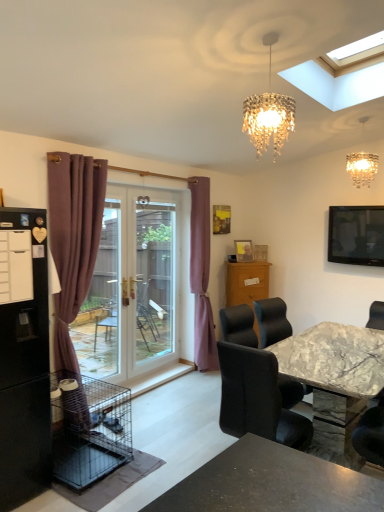
Question: Is marble table at center shorter than marble-textured chair at lower right?

Choices:
 (A) yes
 (B) no

Answer: (B)

Question: Is marble table at center positioned beyond the bounds of marble-textured chair at lower right?

Choices:
 (A) yes
 (B) no

Answer: (A)

Question: Is marble table at center far away from marble-textured chair at lower right?

Choices:
 (A) no
 (B) yes

Answer: (A)

Question: Considering the relative sizes of marble table at center and marble-textured chair at lower right in the image provided, is marble table at center wider than marble-textured chair at lower right?

Choices:
 (A) yes
 (B) no

Answer: (A)

Question: Can you confirm if marble table at center is bigger than marble-textured chair at lower right?

Choices:
 (A) yes
 (B) no

Answer: (A)

Question: Is marble table at center taller than marble-textured chair at lower right?

Choices:
 (A) yes
 (B) no

Answer: (A)

Question: From the image's perspective, does wooden picture frame at center appear lower than crystal glass chandelier at upper center?

Choices:
 (A) no
 (B) yes

Answer: (B)

Question: From a real-world perspective, is wooden picture frame at center below crystal glass chandelier at upper center?

Choices:
 (A) yes
 (B) no

Answer: (A)

Question: From the image's perspective, is wooden picture frame at center above crystal glass chandelier at upper center?

Choices:
 (A) yes
 (B) no

Answer: (B)

Question: Does wooden picture frame at center have a larger size compared to crystal glass chandelier at upper center?

Choices:
 (A) no
 (B) yes

Answer: (A)

Question: Is crystal glass chandelier at upper center completely or partially inside wooden picture frame at center?

Choices:
 (A) no
 (B) yes

Answer: (A)

Question: Considering the relative sizes of wooden picture frame at center and crystal glass chandelier at upper center in the image provided, is wooden picture frame at center thinner than crystal glass chandelier at upper center?

Choices:
 (A) yes
 (B) no

Answer: (A)

Question: Considering the relative positions of black wire birdcage at lower left and wooden picture frame at center in the image provided, is black wire birdcage at lower left to the left of wooden picture frame at center from the viewer's perspective?

Choices:
 (A) yes
 (B) no

Answer: (A)